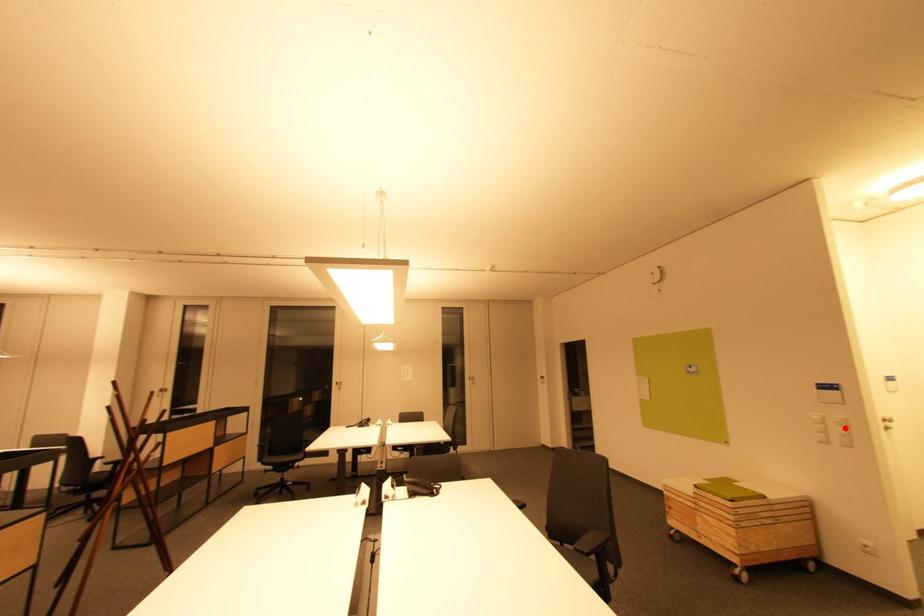
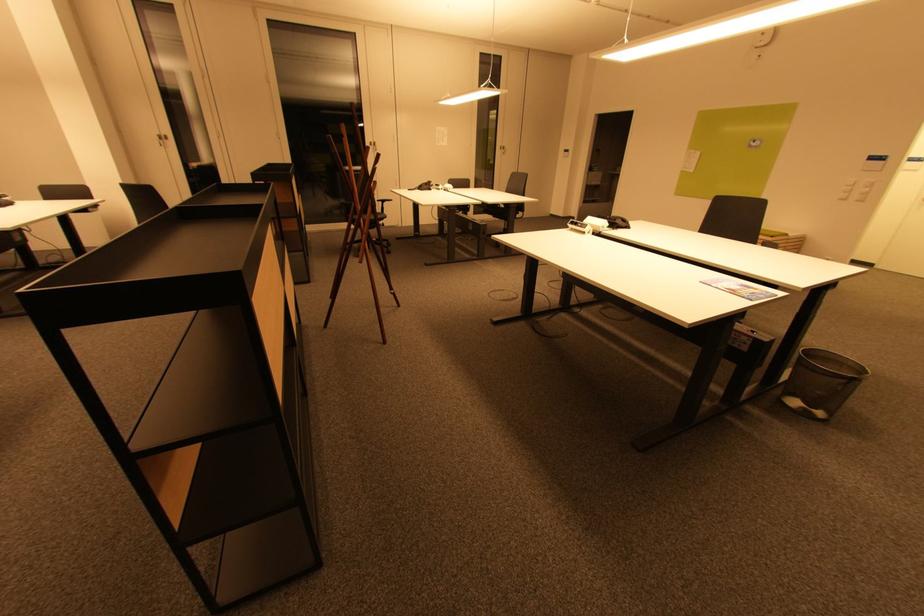
Question: I am providing you with two images of the same scene from different viewpoints. A red point is shown in image1. For the corresponding object point in image2, is it positioned nearer or farther from the camera?

Choices:
 (A) Nearer
 (B) Farther

Answer: (B)